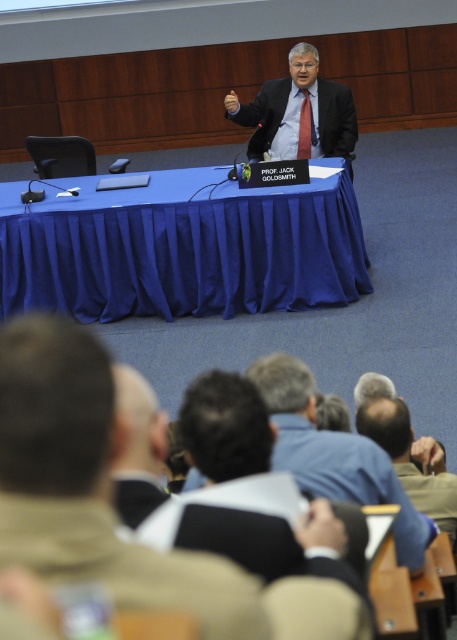
Looking at this image, you are an event organizer and need to arrange a photo shoot for the speaker. The photographer wants to capture the speaker while focusing on his dark blue shirt at center without the brown leather jacket at lower center appearing in the frame. Is the jacket positioned in a way that it might obstruct the view of the shirt?

The brown leather jacket at lower center is positioned on the left side of the dark blue shirt at center, so it might obstruct the view of the shirt if the camera is positioned to the right of the jacket. To avoid this, the photographer should adjust the angle to ensure the jacket is not overlapping the shirt.

You are standing in the conference room and want to place a small plant on the table at the exact location marked by the point (x=26, y=224). If the table is 2 meters long and 1 meter wide, can you fit the plant there without it hanging off the edge?

The point (x=26, y=224) is 6.10 meters away from the camera, but the table is only 2 meters long and 1 meter wide. Since the distance from the camera to the table is not provided, we cannot determine if the plant will fit without additional information about the table position relative to the camera.